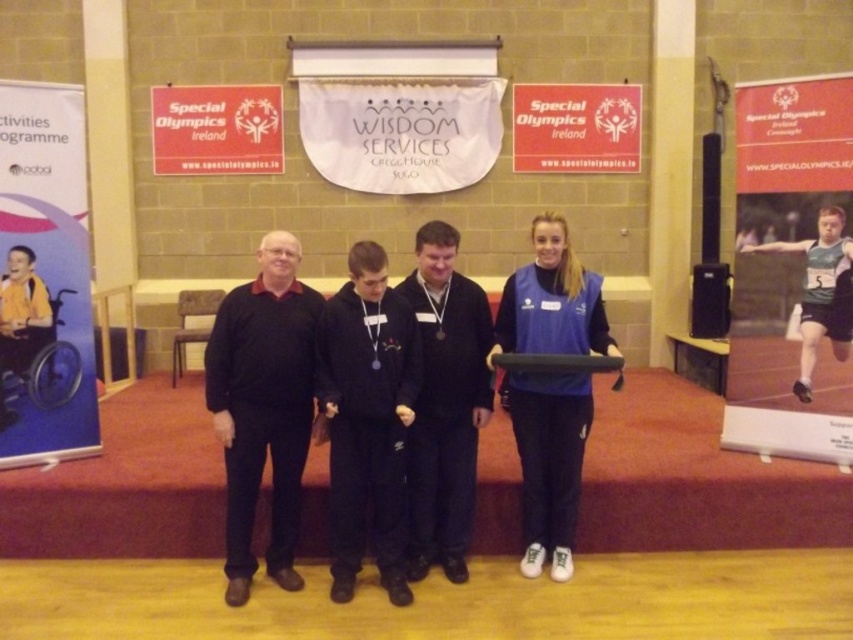
Which is below, black matte sweater at center or black fleece at center?

black fleece at center is below.

What do you see at coordinates (263, 406) in the screenshot? The width and height of the screenshot is (853, 640). I see `black matte sweater at center` at bounding box center [263, 406].

Image resolution: width=853 pixels, height=640 pixels. I want to click on black matte sweater at center, so click(263, 406).

Can you confirm if blue fabric vest at center is positioned below green athletic uniform at center?

Yes.

Identify the location of blue fabric vest at center. (549, 461).

Which is behind, point (534, 310) or point (842, 312)?

Point (842, 312)

The height and width of the screenshot is (640, 853). I want to click on blue fabric vest at center, so click(x=549, y=461).

Is black fleece at center shorter than blue fabric vest at center?

Yes.

What are the coordinates of `black fleece at center` in the screenshot? It's located at (366, 419).